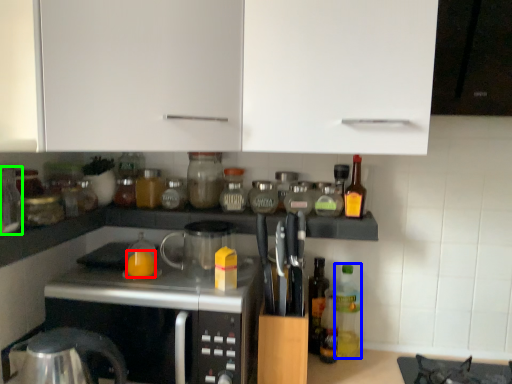
Question: Which is nearer to the orange juice (highlighted by a red box)? bottle (highlighted by a blue box) or bottle (highlighted by a green box).

Choices:
 (A) bottle
 (B) bottle

Answer: (B)